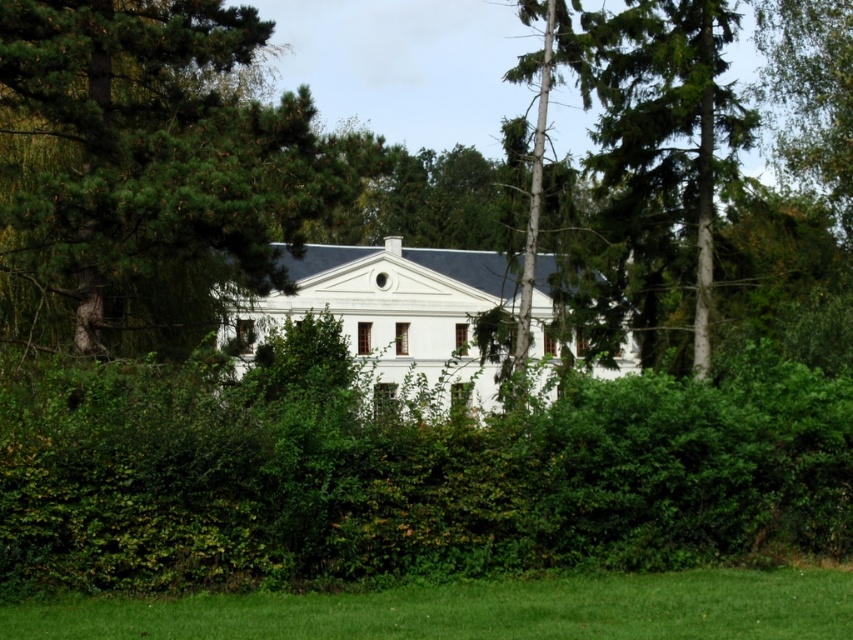
Question: Is green leafy hedge at center below smooth bark tree at center?

Choices:
 (A) no
 (B) yes

Answer: (B)

Question: Where is green leafy hedge at center located in relation to smooth bark tree at center in the image?

Choices:
 (A) above
 (B) below

Answer: (B)

Question: Which point is closer to the camera taking this photo?

Choices:
 (A) (662, 84)
 (B) (229, 236)
 (C) (540, 77)
 (D) (271, 500)

Answer: (D)

Question: Which object appears closest to the camera in this image?

Choices:
 (A) green pine tree at center
 (B) smooth bark tree at center
 (C) green leafy tree at upper right

Answer: (B)

Question: Which point is farther from the camera taking this photo?

Choices:
 (A) (544, 74)
 (B) (184, 540)

Answer: (A)

Question: Does green pine tree at center have a smaller size compared to green leafy tree at upper right?

Choices:
 (A) no
 (B) yes

Answer: (A)